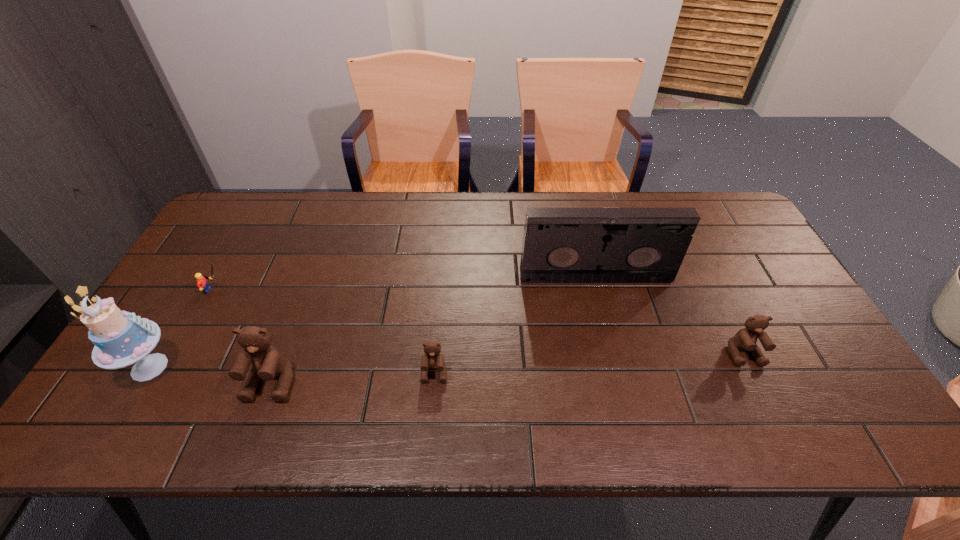
This screenshot has width=960, height=540. I want to click on the tallest teddy bear, so click(267, 362).

You are a GUI agent. You are given a task and a screenshot of the screen. Output one action in this format:
    pyautogui.click(x=<x>, y=<y>)
    Task: Click on the fourth object from right to left
    
    Given the screenshot: What is the action you would take?
    pyautogui.click(x=267, y=362)

At what (x,y) coordinates should I click in order to perform the action: click on the shortest teddy bear. Please return your answer as a coordinate pair (x, y). The height and width of the screenshot is (540, 960). Looking at the image, I should click on (432, 359).

Locate an element on the screen. the fourth object from left to right is located at coordinates (432, 359).

Locate an element on the screen. The height and width of the screenshot is (540, 960). the fourth tallest object is located at coordinates (745, 339).

Find the location of a particular element. The height and width of the screenshot is (540, 960). the rightmost teddy bear is located at coordinates (745, 339).

At what (x,y) coordinates should I click in order to perform the action: click on Lego. Please return your answer as a coordinate pair (x, y). The height and width of the screenshot is (540, 960). Looking at the image, I should click on (202, 283).

Find the location of a particular element. The width and height of the screenshot is (960, 540). the fifth object from left to right is located at coordinates (560, 245).

What are the coordinates of `videotape` in the screenshot? It's located at (560, 245).

The image size is (960, 540). I want to click on cake, so click(121, 338).